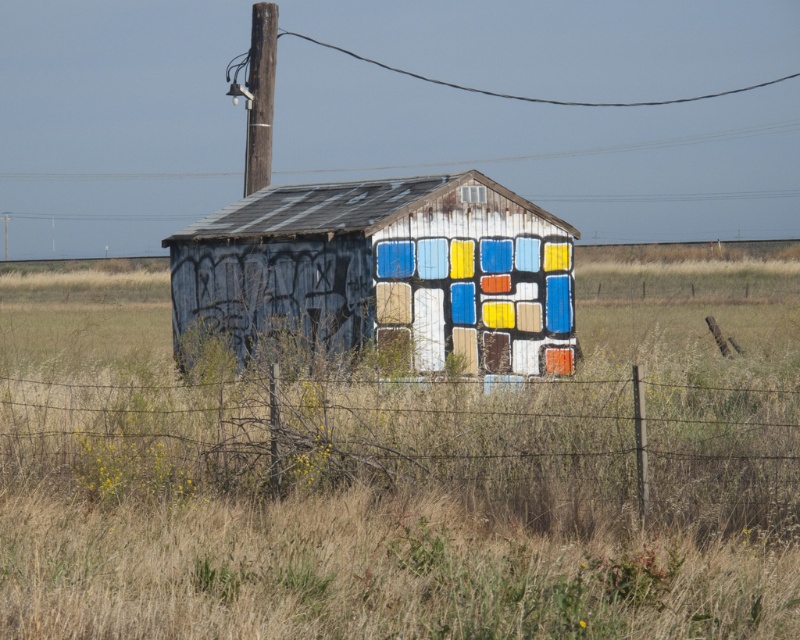
You are a maintenance worker needing to inspect both the brown wooden telegraph pole at upper center and the transparent plastic window at upper center. Given that your ladder is 8 meters long, can you safely reach both objects from the ground without moving the ladder?

The distance between the brown wooden telegraph pole at upper center and the transparent plastic window at upper center is 8.48 meters. Since the ladder is only 8 meters long, it is not long enough to safely reach both objects without moving it.

Looking at this image, you are a maintenance worker checking the electrical setup of the shed. You need to determine which wire has a larger width between the wire mesh at lower center and the black wire at upper center. Which one is wider?

The wire mesh at lower center is less than black wire at upper center in width, so the black wire at upper center is wider.